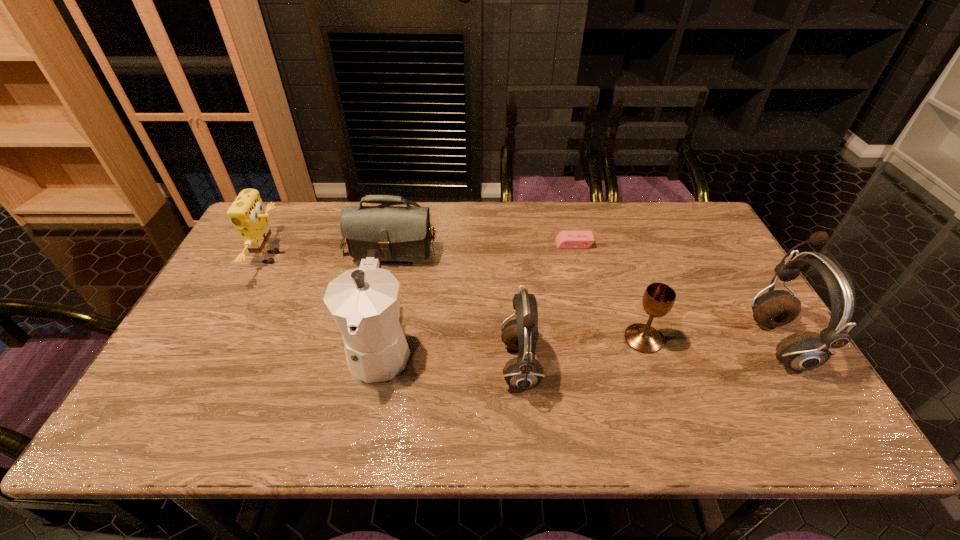
Where is `free point that keeps the earphones evenly spaced on the left`? free point that keeps the earphones evenly spaced on the left is located at coordinates (234, 395).